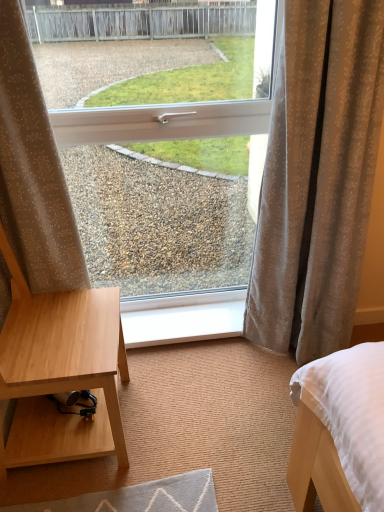
You are a GUI agent. You are given a task and a screenshot of the screen. Output one action in this format:
    pyautogui.click(x=<x>, y=<y>)
    Task: Click on the vacant space that is to the left of beige textured curtain at right, which appears as the 2th curtain when viewed from the left
    This screenshot has width=384, height=512.
    Given the screenshot: What is the action you would take?
    pyautogui.click(x=213, y=375)